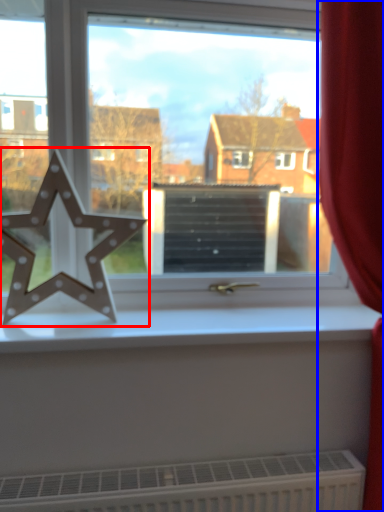
Question: Among these objects, which one is farthest to the camera, letter (highlighted by a red box) or curtain (highlighted by a blue box)?

Choices:
 (A) letter
 (B) curtain

Answer: (A)